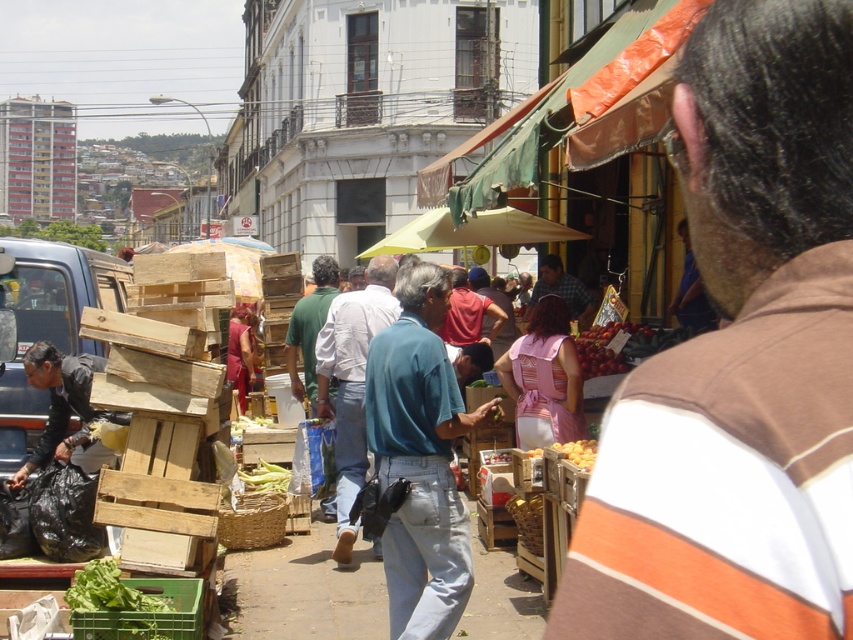
Question: Does black leather jacket at lower left have a lesser width compared to checkered shirt at center?

Choices:
 (A) no
 (B) yes

Answer: (A)

Question: Considering the relative positions of shiny red apples at center and green leafy lettuce at lower left in the image provided, where is shiny red apples at center located with respect to green leafy lettuce at lower left?

Choices:
 (A) left
 (B) right

Answer: (B)

Question: Which of the following is the farthest from the observer?

Choices:
 (A) (572, 454)
 (B) (646, 346)

Answer: (B)

Question: Can you confirm if shiny red apples at center is bigger than checkered shirt at center?

Choices:
 (A) no
 (B) yes

Answer: (A)

Question: Which object appears farthest from the camera in this image?

Choices:
 (A) shiny red cherries at center
 (B) brown striped shirt at center

Answer: (A)

Question: Among these points, which one is farthest from the camera?

Choices:
 (A) (268, 467)
 (B) (682, 340)
 (C) (67, 442)

Answer: (A)